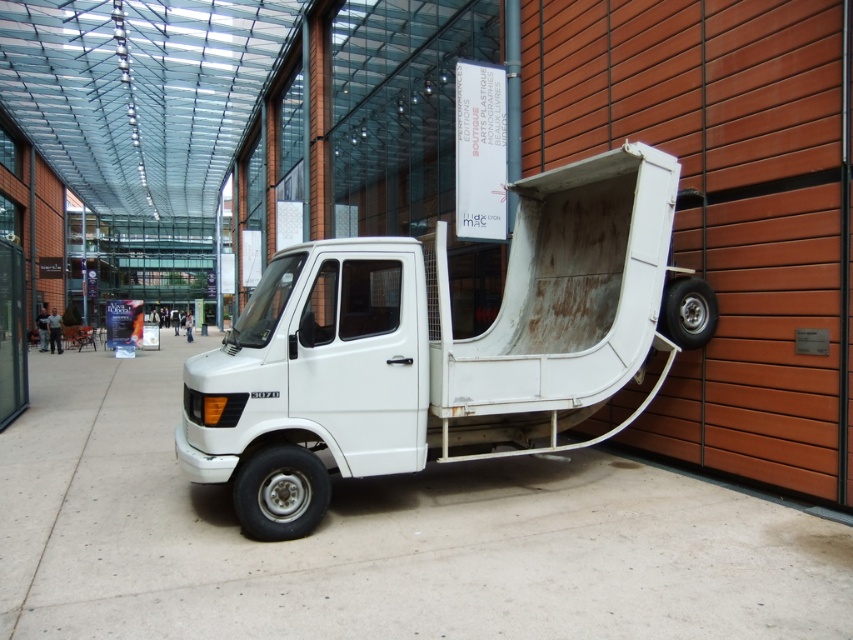
Can you confirm if gray concrete pavement at center is smaller than white matte truck at center?

Actually, gray concrete pavement at center might be larger than white matte truck at center.

Can you confirm if gray concrete pavement at center is positioned to the left of white matte truck at center?

Correct, you'll find gray concrete pavement at center to the left of white matte truck at center.

Locate an element on the screen. This screenshot has height=640, width=853. gray concrete pavement at center is located at coordinates (380, 538).